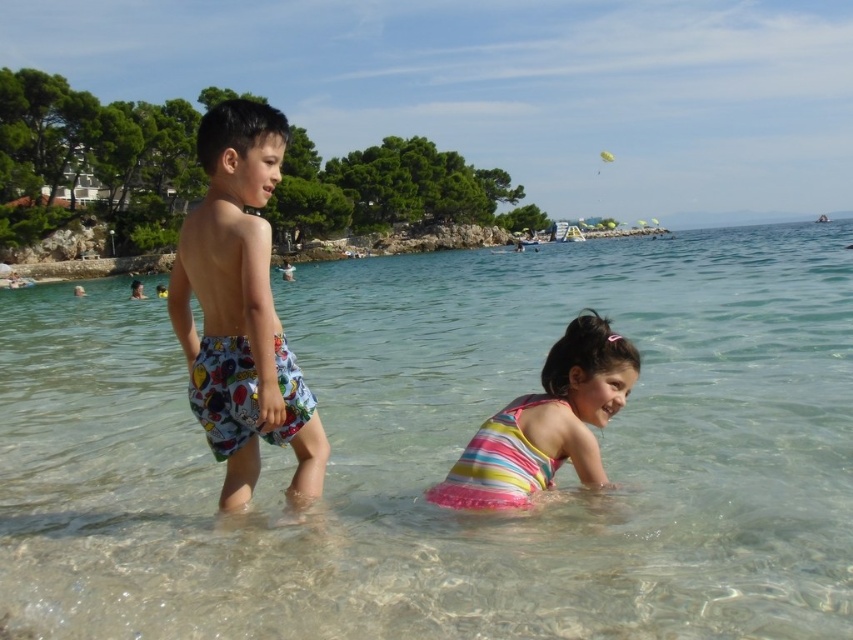
Based on the scene description, where is the clear water at center located in terms of coordinates?

The clear water at center is located at coordinates point (450, 452).

You are a photographer standing at the edge of the beach. You want to take a photo that includes both the point at [256,262] and the point at [506,432]. Which point should you focus on first to ensure both are in clear view?

You should focus on point [256,262] first because it is closer to you than point [506,432], ensuring both points remain in clear focus.